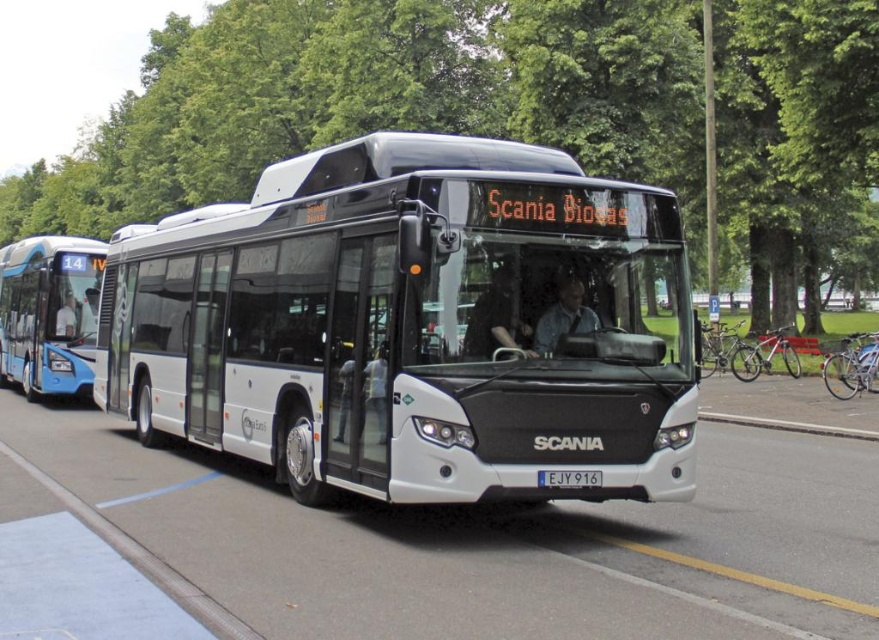
Does blue fabric shirt at center appear over white plastic license plate at center?

Yes.

Is point (569, 273) positioned before point (596, 474)?

No, it is behind (596, 474).

Where is `blue fabric shirt at center`? blue fabric shirt at center is located at coordinates (564, 317).

Between green leafy tree at upper center and white plastic license plate at center, which one appears on the left side from the viewer's perspective?

green leafy tree at upper center

Can you confirm if green leafy tree at upper center is thinner than white plastic license plate at center?

No.

Describe the element at coordinates (514, 116) in the screenshot. I see `green leafy tree at upper center` at that location.

What are the coordinates of `green leafy tree at upper center` in the screenshot? It's located at 514,116.

Based on the photo, which of these two, white matte bus at center or white rubber line at lower center, stands taller?

With more height is white matte bus at center.

Is white matte bus at center smaller than white rubber line at lower center?

Incorrect, white matte bus at center is not smaller in size than white rubber line at lower center.

At what (x,y) coordinates should I click in order to perform the action: click on white matte bus at center. Please return your answer as a coordinate pair (x, y). Looking at the image, I should click on (412, 324).